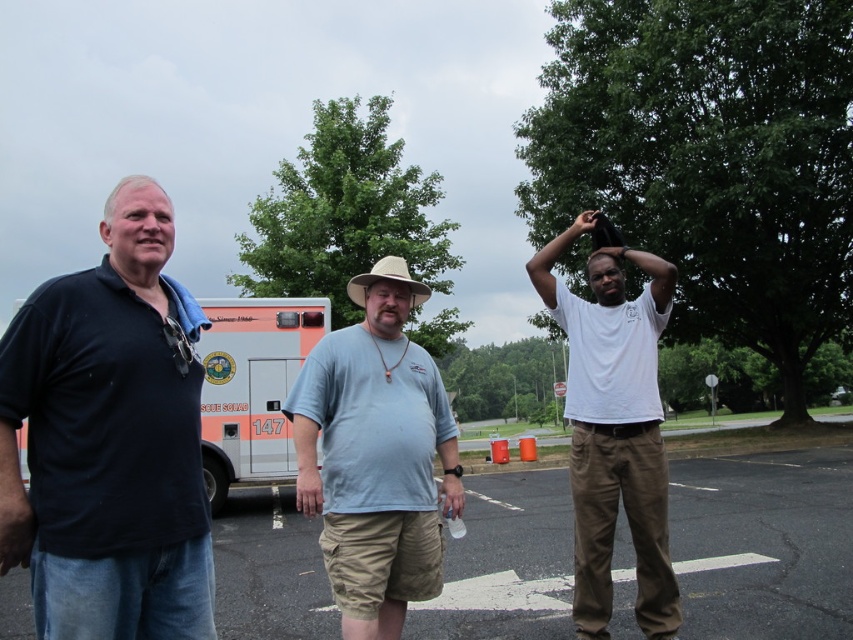
Question: Does dark blue cotton shirt at left come in front of white glossy ambulance at center?

Choices:
 (A) yes
 (B) no

Answer: (A)

Question: From the image, what is the correct spatial relationship of orange matte ambulance at left in relation to white glossy ambulance at center?

Choices:
 (A) left
 (B) right

Answer: (B)

Question: Does orange matte ambulance at left have a greater width compared to white glossy ambulance at center?

Choices:
 (A) no
 (B) yes

Answer: (A)

Question: Which of the following is the closest to the observer?

Choices:
 (A) orange matte ambulance at left
 (B) light blue cotton shirt at center
 (C) white matte t-shirt at center
 (D) white glossy ambulance at center

Answer: (B)

Question: Which object is positioned closest to the light blue cotton shirt at center?

Choices:
 (A) orange matte ambulance at left
 (B) white matte t-shirt at center
 (C) dark blue cotton shirt at left
 (D) white glossy ambulance at center

Answer: (C)

Question: Which point is farther to the camera?

Choices:
 (A) light blue cotton shirt at center
 (B) dark blue cotton shirt at left
 (C) white glossy ambulance at center
 (D) orange matte ambulance at left

Answer: (D)